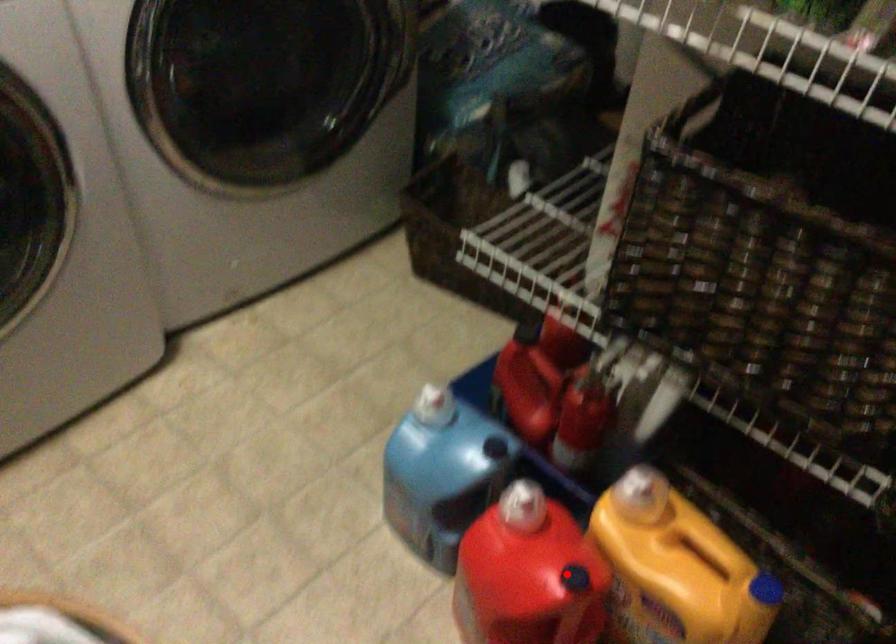
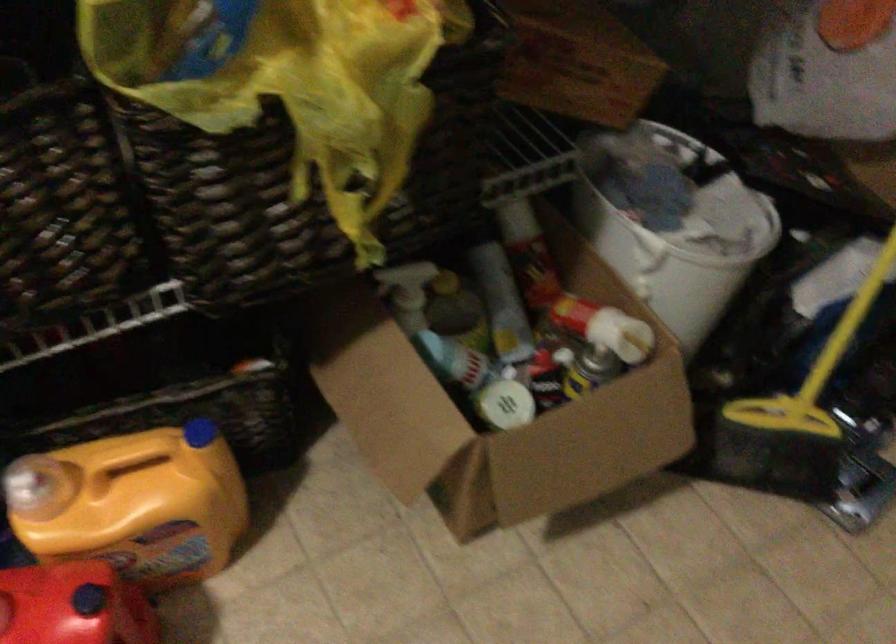
In the second image, find the point that corresponds to the highlighted location in the first image.

(73, 605)